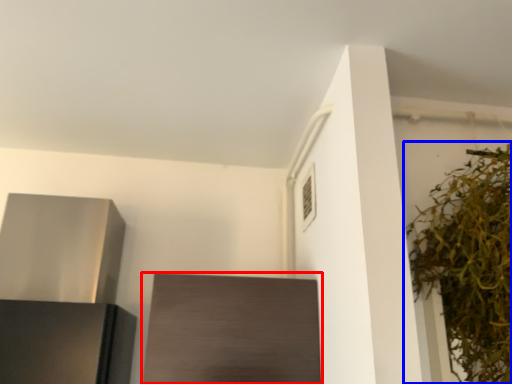
Question: Which of the following is the farthest to the observer, cabinetry (highlighted by a red box) or houseplant (highlighted by a blue box)?

Choices:
 (A) cabinetry
 (B) houseplant

Answer: (A)